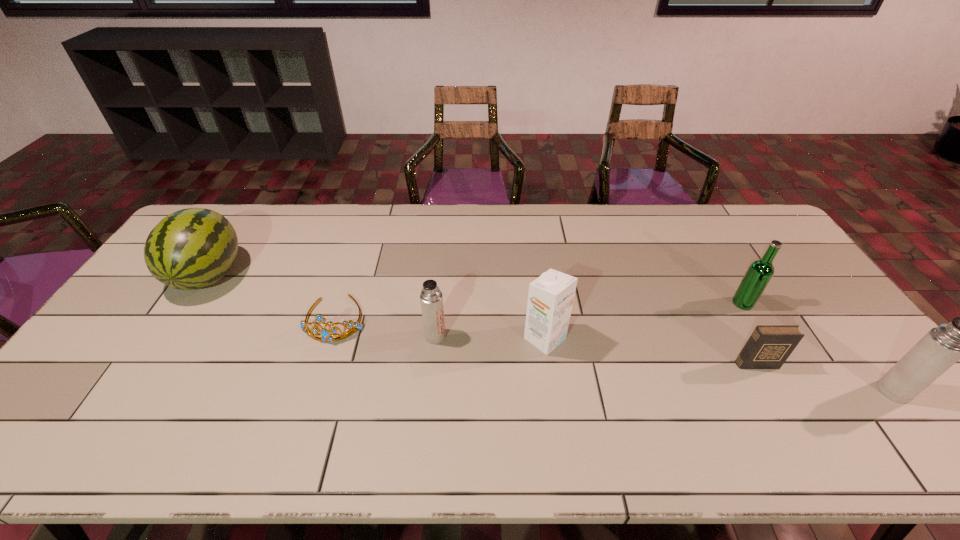
The height and width of the screenshot is (540, 960). I want to click on free area in between the nearer thermos bottle and the sixth tallest object, so click(x=826, y=377).

The height and width of the screenshot is (540, 960). I want to click on vacant space that is in between the diary and the fourth object from left to right, so click(x=651, y=352).

Locate an element on the screen. This screenshot has width=960, height=540. free space that is in between the diary and the shorter thermos bottle is located at coordinates tap(596, 350).

Identify the location of free space between the fourth object from right to left and the beer bottle. (644, 321).

Locate which object ranks sixth in proximity to the left thermos bottle. Please provide its 2D coordinates. Your answer should be formatted as a tuple, i.e. [(x, y)], where the tuple contains the x and y coordinates of a point satisfying the conditions above.

[(942, 346)]

Find the location of `the third closest object to the leftmost object`. the third closest object to the leftmost object is located at coordinates (550, 298).

Locate an element on the screen. The image size is (960, 540). vacant space that satisfies the following two spatial constraints: 1. on the front side of the carton; 2. on the right side of the third object from left to right is located at coordinates (435, 339).

You are a GUI agent. You are given a task and a screenshot of the screen. Output one action in this format:
    pyautogui.click(x=<x>, y=<y>)
    Task: Click on the vacant position in the image that satisfies the following two spatial constraints: 1. on the back side of the farther thermos bottle; 2. on the left side of the beer bottle
    This screenshot has width=960, height=540.
    Given the screenshot: What is the action you would take?
    pyautogui.click(x=439, y=303)

The image size is (960, 540). Find the location of `free space that satisfies the following two spatial constraints: 1. at the stem end of the watermelon; 2. on the right side of the fourth object from right to left`. free space that satisfies the following two spatial constraints: 1. at the stem end of the watermelon; 2. on the right side of the fourth object from right to left is located at coordinates (167, 339).

Identify the location of free location that satisfies the following two spatial constraints: 1. at the stem end of the beer bottle; 2. on the left side of the watermelon. (190, 303).